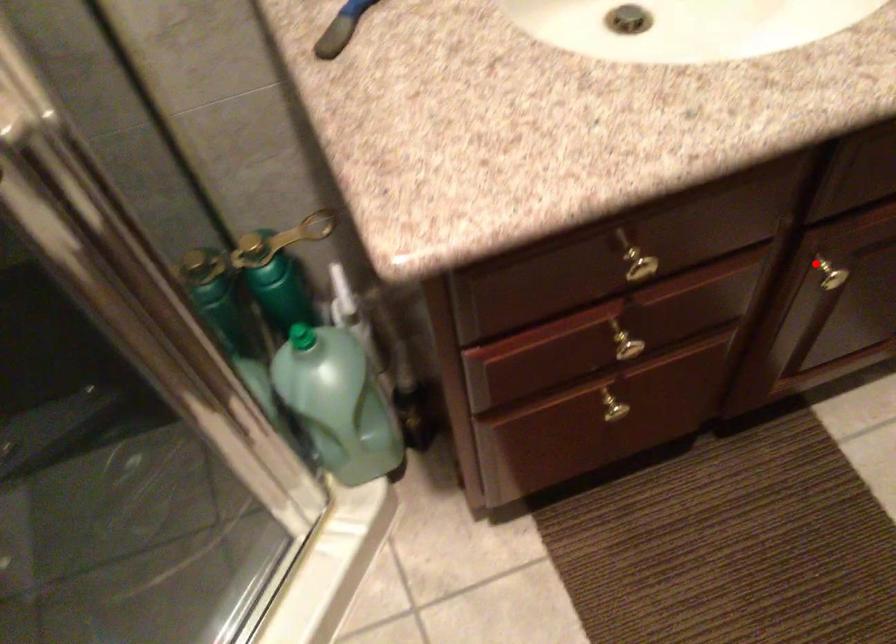
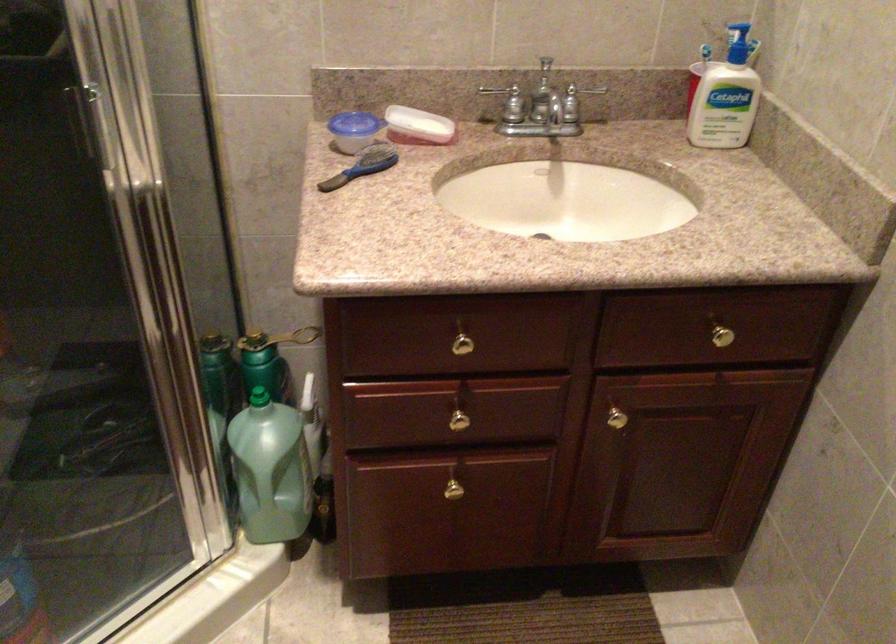
Where in the second image is the point corresponding to the highlighted location from the first image?

(612, 411)